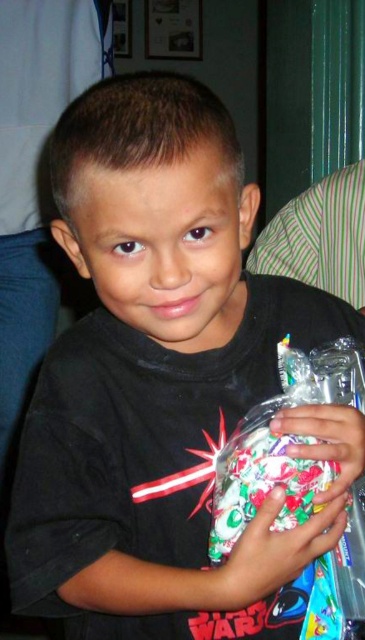
You are a delivery person who just arrived at a house. You see a shiny plastic bag of candies at center and a floral fabric wrapped gift at center. The homeowner says they need the gift placed exactly where the candies are. Can you move the candies to another spot without moving the gift?

The shiny plastic bag of candies at center is only 3.55 centimeters away from the floral fabric wrapped gift at center. Since the distance is very small, you can carefully move the candies to a nearby location while keeping the gift in its original position.

Based on the scene description, where is the floral fabric wrapped gift at center located in relation to the boy?

The floral fabric wrapped gift at center is located at point (275, 550) in the image coordinate system.

The scene shows a boy holding two items at the center. Which item is wider, the shiny plastic bag of candies at center or the floral fabric wrapped gift at center?

The floral fabric wrapped gift at center is wider than the shiny plastic bag of candies at center.